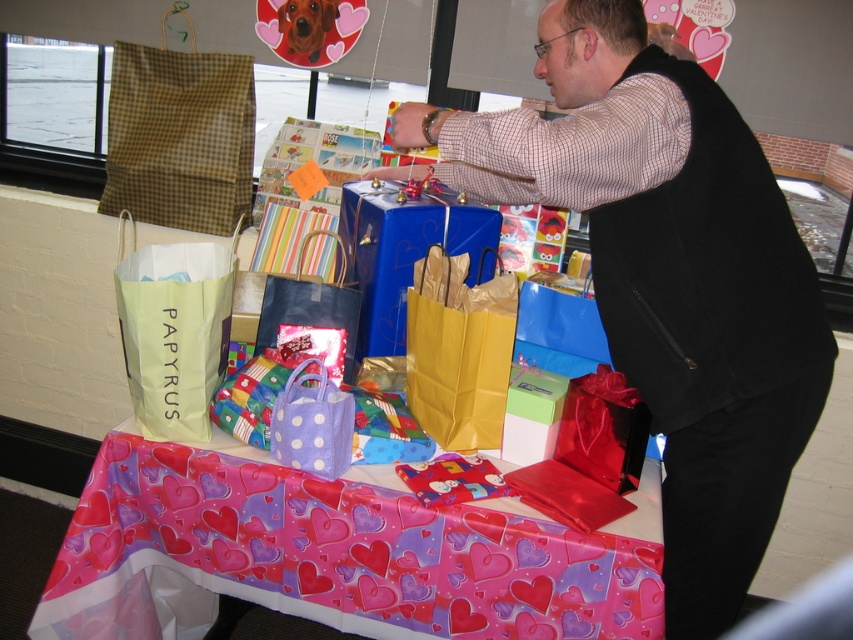
Identify the location of valentine-patterned paper at center. The image size is (853, 640). (335, 554).

Does valentine-patterned paper at center have a greater height compared to green paper bag at left?

Indeed, valentine-patterned paper at center has a greater height compared to green paper bag at left.

Identify the location of valentine-patterned paper at center. (335, 554).

Does point (494, 362) come in front of point (305, 456)?

No, it is behind (305, 456).

Does gold paper bag at center have a lesser height compared to purple polka dot bag at center?

No.

The width and height of the screenshot is (853, 640). Describe the element at coordinates (457, 352) in the screenshot. I see `gold paper bag at center` at that location.

This screenshot has width=853, height=640. What are the coordinates of `gold paper bag at center` in the screenshot? It's located at (x=457, y=352).

Does matte black vest at center appear under shiny black bag at lower right?

No, matte black vest at center is not below shiny black bag at lower right.

From the picture: Does matte black vest at center have a lesser height compared to shiny black bag at lower right?

Incorrect, matte black vest at center's height does not fall short of shiny black bag at lower right's.

Locate an element on the screen. This screenshot has height=640, width=853. matte black vest at center is located at coordinates (666, 276).